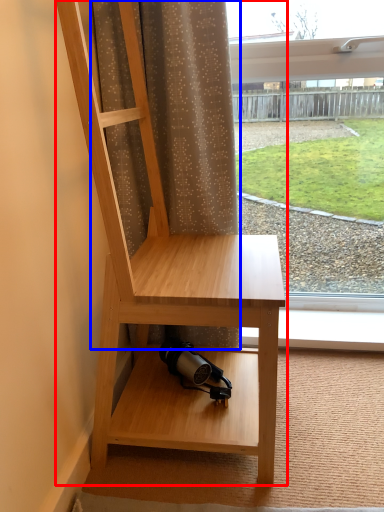
Question: Which object appears closest to the camera in this image, furniture (highlighted by a red box) or curtain (highlighted by a blue box)?

Choices:
 (A) furniture
 (B) curtain

Answer: (A)